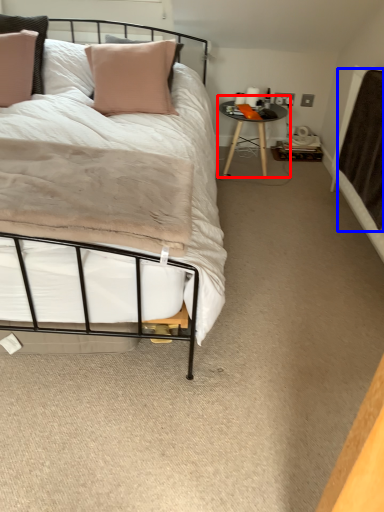
Question: Which object is further to the camera taking this photo, table (highlighted by a red box) or blanket (highlighted by a blue box)?

Choices:
 (A) table
 (B) blanket

Answer: (A)